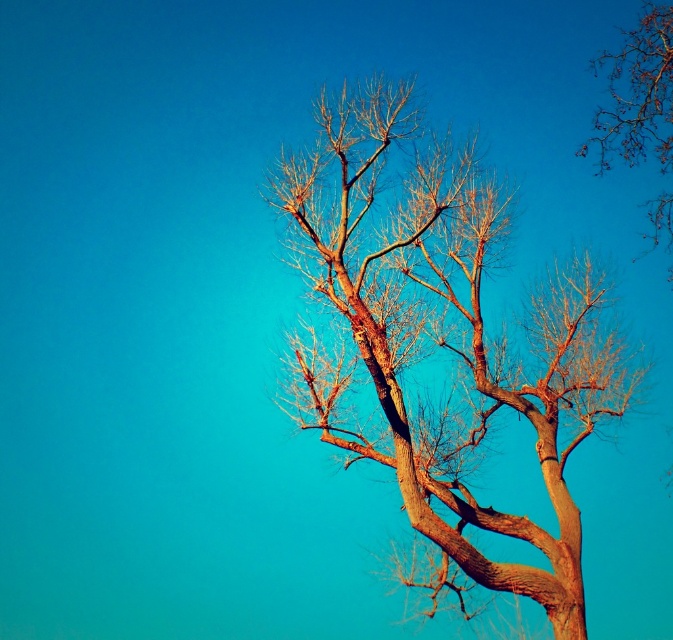
You are an artist trying to sketch the scene. You notice the brown textured tree at center and the bare branches at upper right. Which object should you draw first if you want to follow the standard top to bottom drawing technique?

You should draw the bare branches at upper right first because they are located above the brown textured tree at center, following the top to bottom drawing technique.

You are an artist trying to paint the scene. You want to ensure the brown textured tree at center and the bare branches at upper right are proportionally accurate. Which object should you draw first to maintain the correct size relationship?

You should draw the brown textured tree at center first because it is larger than the bare branches at upper right, ensuring the size relationship is maintained.